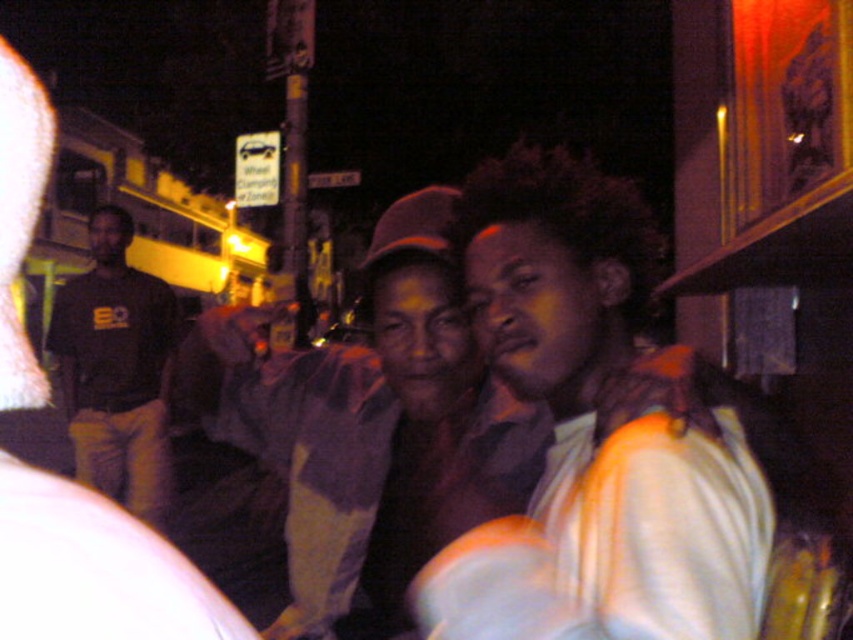
Question: Considering the real-world distances, which object is farthest from the matte black shirt at center?

Choices:
 (A) black cotton shirt at left
 (B) light blue shirt at center
 (C) matte purple shirt at center

Answer: (A)

Question: Considering the relative positions of matte black shirt at center and black cotton shirt at left in the image provided, where is matte black shirt at center located with respect to black cotton shirt at left?

Choices:
 (A) above
 (B) below

Answer: (A)

Question: Does light blue shirt at center appear over black cotton shirt at left?

Choices:
 (A) no
 (B) yes

Answer: (B)

Question: Estimate the real-world distances between objects in this image. Which object is farther from the black cotton shirt at left?

Choices:
 (A) matte purple shirt at center
 (B) matte black shirt at center

Answer: (B)

Question: Can you confirm if light blue shirt at center is positioned below black cotton shirt at left?

Choices:
 (A) yes
 (B) no

Answer: (B)

Question: Which object is positioned farthest from the light blue shirt at center?

Choices:
 (A) black cotton shirt at left
 (B) matte purple shirt at center

Answer: (A)